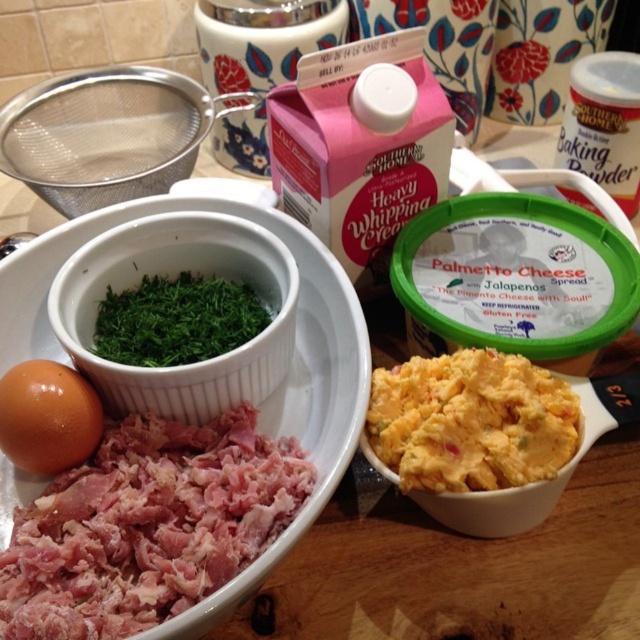
Question: Which point is closer to the camera taking this photo?

Choices:
 (A) (508, 410)
 (B) (163, 355)

Answer: (A)

Question: Is pinkish raw meat at lower left below yellowish-orange creamy spread at center-right?

Choices:
 (A) no
 (B) yes

Answer: (B)

Question: Is yellowish-orange creamy spread at center-right below brown matte egg at lower left?

Choices:
 (A) no
 (B) yes

Answer: (A)

Question: Which is farther from the pinkish raw meat at lower left?

Choices:
 (A) yellowish-orange creamy spread at center-right
 (B) brown matte egg at lower left
 (C) green leafy herb at lower left

Answer: (A)

Question: Which of the following is the closest to the observer?

Choices:
 (A) (225, 269)
 (B) (88, 428)

Answer: (B)

Question: Does green leafy herb at lower left appear under brown matte egg at lower left?

Choices:
 (A) yes
 (B) no

Answer: (B)